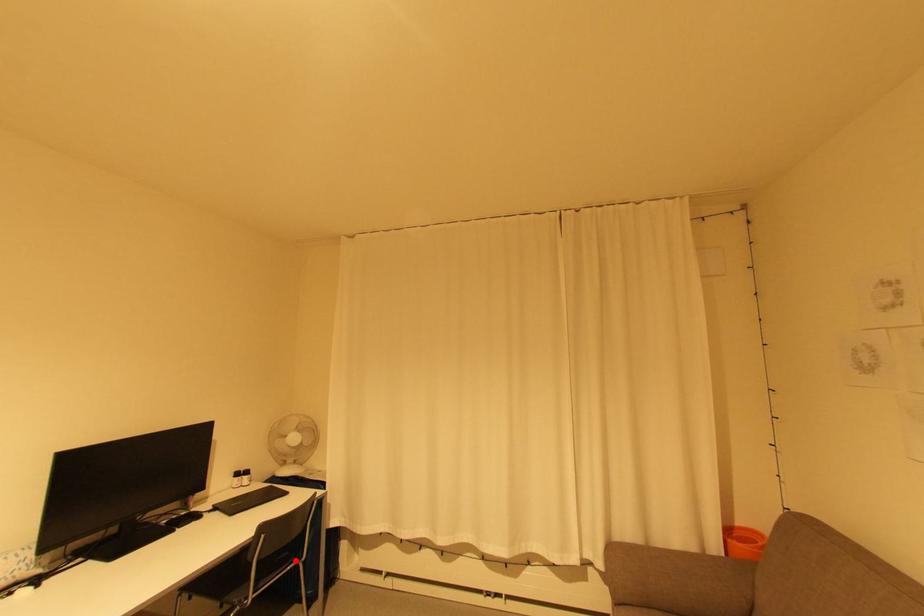
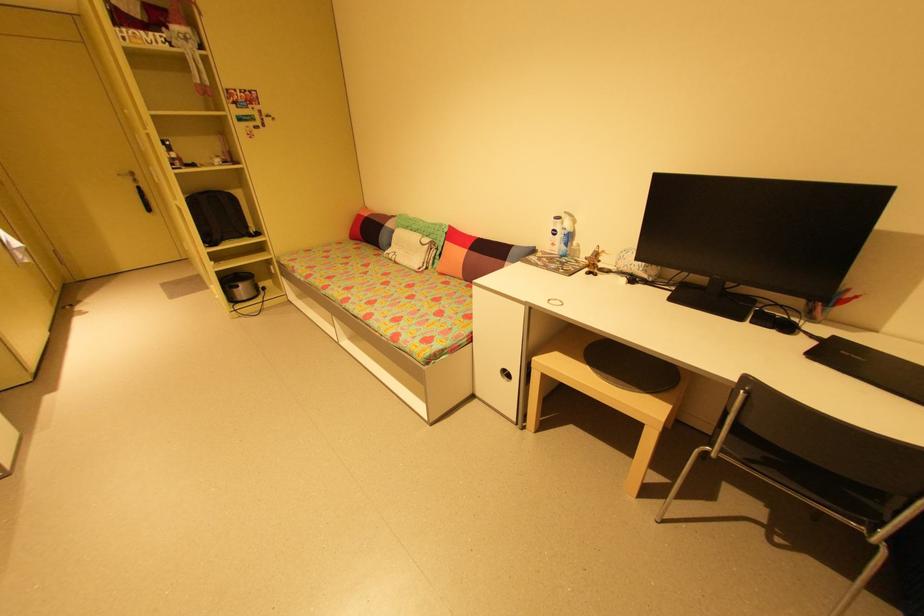
Where in the second image is the point corresponding to the highlighted location from the first image?

(869, 519)